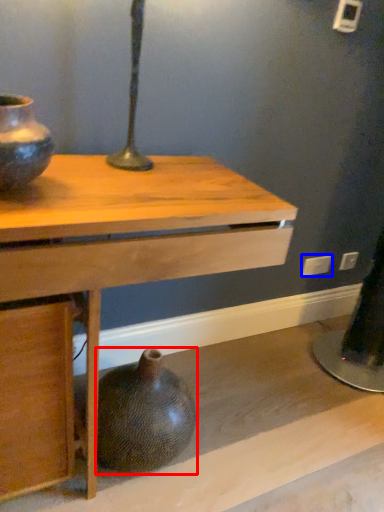
Question: Among these objects, which one is nearest to the camera, vase (highlighted by a red box) or electric outlet (highlighted by a blue box)?

Choices:
 (A) vase
 (B) electric outlet

Answer: (A)